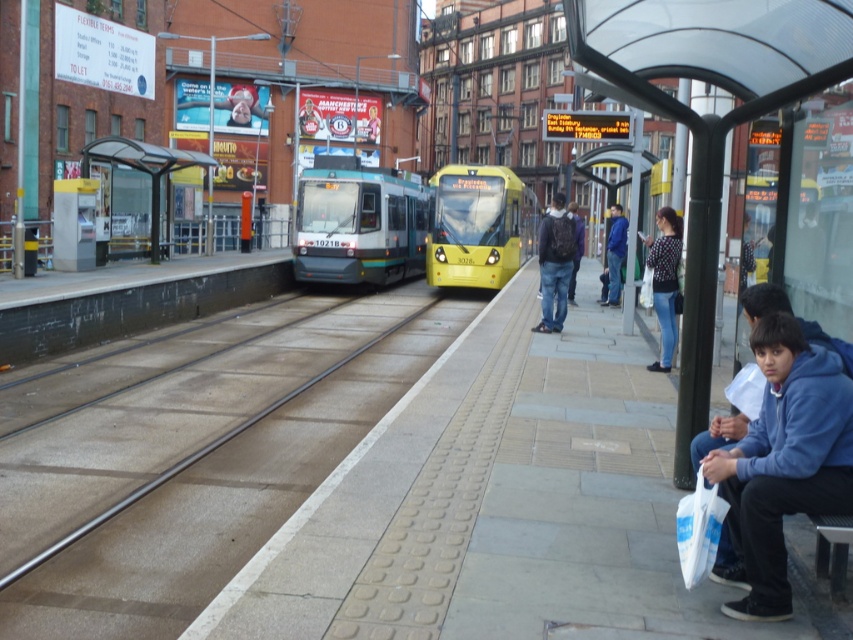
Question: Which point is farther from the camera taking this photo?

Choices:
 (A) (550, 248)
 (B) (517, 228)
 (C) (352, 404)

Answer: (B)

Question: Does yellow matte train at center lie in front of dark blue jeans at center?

Choices:
 (A) no
 (B) yes

Answer: (A)

Question: Is metallic gray tram at center further to camera compared to yellow matte train at center?

Choices:
 (A) no
 (B) yes

Answer: (A)

Question: Which point is closer to the camera?

Choices:
 (A) (546, 317)
 (B) (784, 422)
 (C) (659, 209)

Answer: (B)

Question: Does metallic gray tram at center lie behind polka dot sweater at right?

Choices:
 (A) yes
 (B) no

Answer: (A)

Question: Among these objects, which one is nearest to the camera?

Choices:
 (A) dark blue jacket at center
 (B) blue jacket at center

Answer: (A)